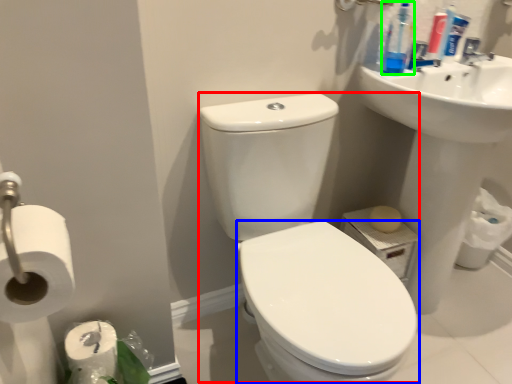
Question: Considering the real-world distances, which object is closest to sink (highlighted by a red box)? bidet (highlighted by a blue box) or cleaning product (highlighted by a green box).

Choices:
 (A) bidet
 (B) cleaning product

Answer: (A)